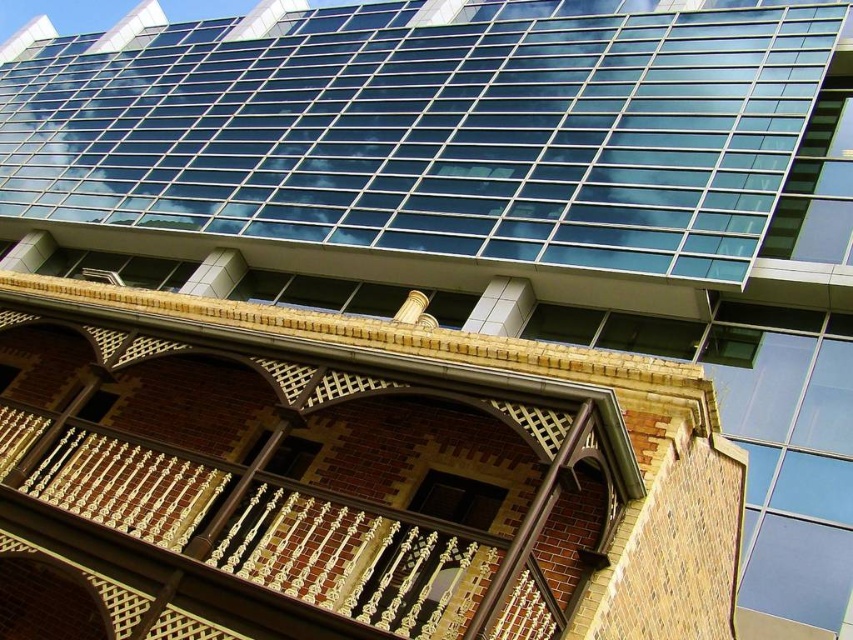
Question: Which object is farther from the camera taking this photo?

Choices:
 (A) brown brick balcony at center
 (B) transparent glass windows at upper center

Answer: (B)

Question: Does transparent glass windows at upper center appear on the right side of brown brick balcony at center?

Choices:
 (A) no
 (B) yes

Answer: (B)

Question: Is transparent glass windows at upper center closer to the viewer compared to brown brick balcony at center?

Choices:
 (A) no
 (B) yes

Answer: (A)

Question: Which of the following is the farthest from the observer?

Choices:
 (A) (227, 362)
 (B) (303, 102)

Answer: (B)

Question: Which point is closer to the camera?

Choices:
 (A) (106, 522)
 (B) (534, 102)

Answer: (A)

Question: In this image, where is transparent glass windows at upper center located relative to brown brick balcony at center?

Choices:
 (A) right
 (B) left

Answer: (A)